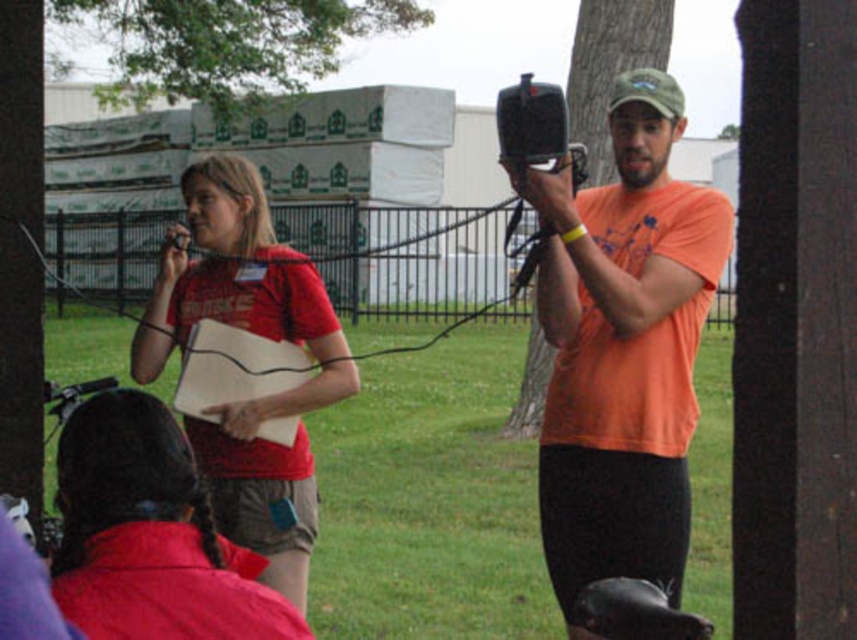
You are standing in the park and see two points marked in the scene. Which point, point 1 at coordinates (363, 16) or point 2 at coordinates (586, 163), is closer to you?

Point 1 at coordinates (363, 16) is closer to you because it is further to the viewer than point 2 at coordinates (586, 163).

You are standing at the point labeled as point [651,42] and want to walk towards the point labeled as point [184,272]. Which direction should you head?

You should head forward because point [184,272] is in front of point [651,42].

You are standing in the park and want to take a photo of the green leafy tree at upper center and the brown textured tree trunk at upper center. Which one will appear closer to you in the photo?

The green leafy tree at upper center will appear closer in the photo because it is positioned closer to the viewer than the brown textured tree trunk at upper center.